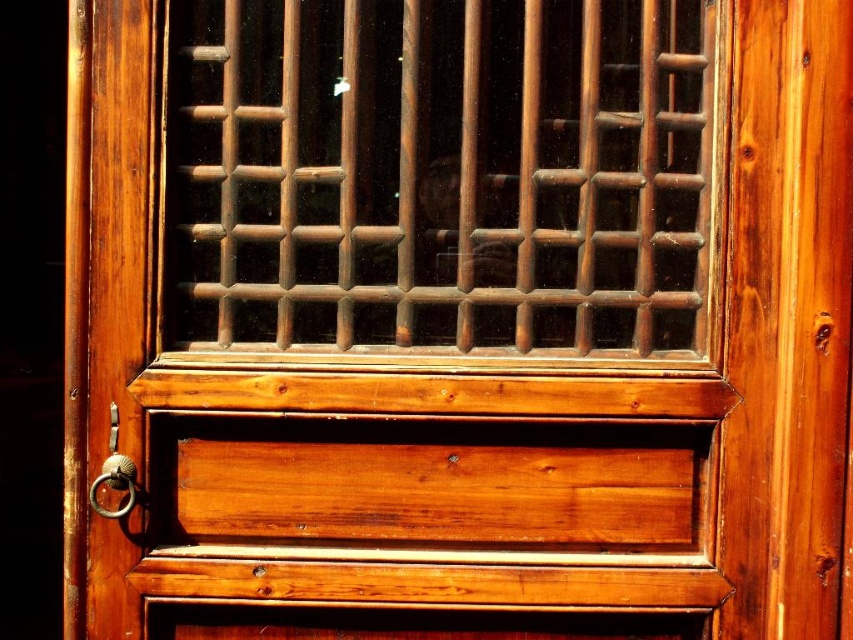
Is brown wooden grid at center bigger than polished brass ring at left?

Yes.

Can you confirm if brown wooden grid at center is taller than polished brass ring at left?

Indeed, brown wooden grid at center has a greater height compared to polished brass ring at left.

Where is `brown wooden grid at center`? The image size is (853, 640). brown wooden grid at center is located at coordinates (440, 179).